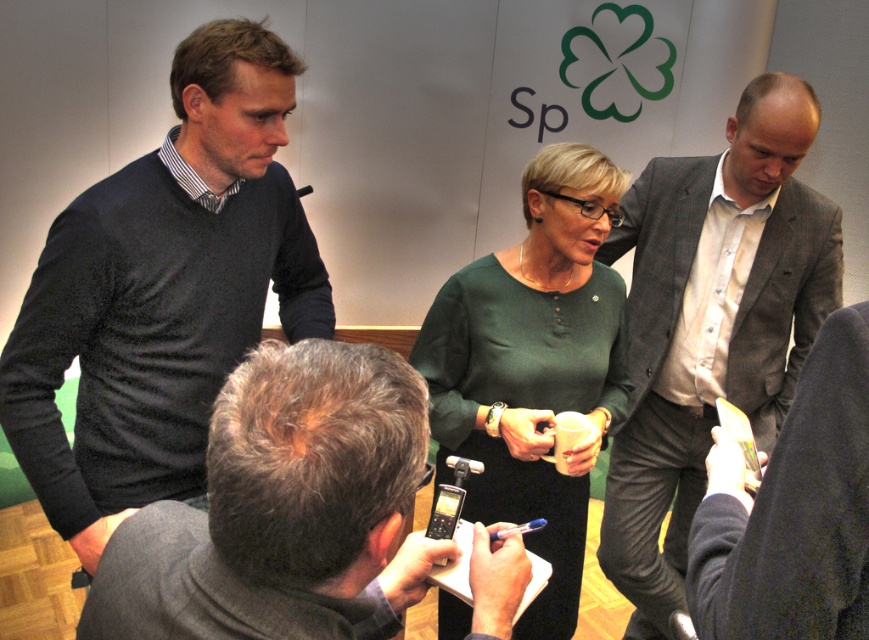
Question: Does dark gray suit at center have a lesser width compared to dark gray suit at lower right?

Choices:
 (A) no
 (B) yes

Answer: (A)

Question: Can you confirm if green matte dress at center is thinner than dark gray suit at lower right?

Choices:
 (A) no
 (B) yes

Answer: (A)

Question: Considering the real-world distances, which object is farthest from the dark gray suit at lower right?

Choices:
 (A) gray suit jacket at center
 (B) dark gray suit at center

Answer: (A)

Question: Does dark gray suit at center appear on the left side of green matte dress at center?

Choices:
 (A) no
 (B) yes

Answer: (B)

Question: Which of the following is the closest to the observer?

Choices:
 (A) green matte dress at center
 (B) dark gray sweater at left

Answer: (B)

Question: Which point appears farthest from the camera in this image?

Choices:
 (A) [x=110, y=204]
 (B) [x=786, y=616]
 (C) [x=503, y=392]

Answer: (C)